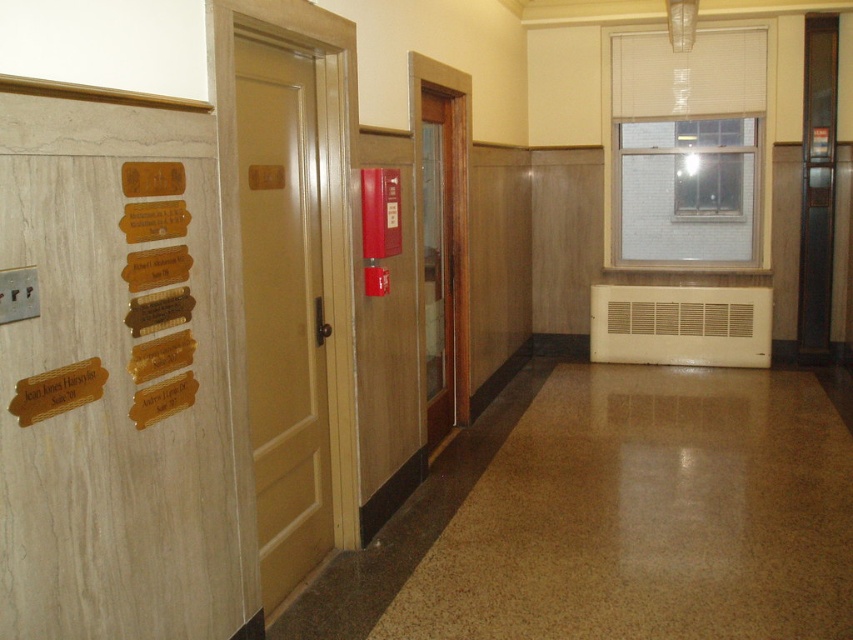
You are standing in the hallway and want to move from the point at coordinates [265,122] to the point at [190,218]. Which direction should you move to get closer to your destination?

To move from point [265,122] to point [190,218], you should move forward since point [265,122] is behind point [190,218].

You are an office worker who needs to enter the matte wood door at center. You notice the gold polished wood nameplates at left above it. Can you walk through the door without touching the nameplates?

The matte wood door at center is positioned under the gold polished wood nameplates at left, so yes, you can walk through the matte wood door at center without touching the gold polished wood nameplates at left since they are above it.

You are an office worker who needs to hang a new plaque on the wall between the matte wood door at center and the wooden door at center. Which door should you stand closer to if you want to reach the plaque easily?

The matte wood door at center is much taller than the wooden door at center, so you should stand closer to the wooden door at center to reach the plaque easily.